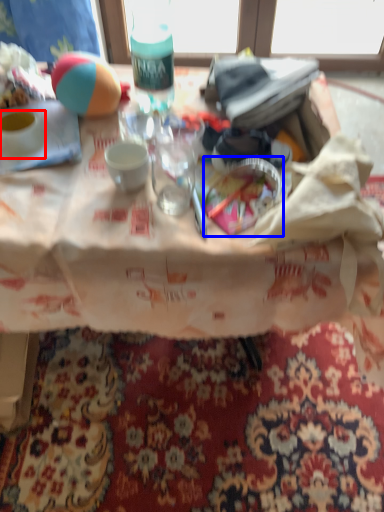
Question: Which point is further to the camera, coffee cup (highlighted by a red box) or tableware (highlighted by a blue box)?

Choices:
 (A) coffee cup
 (B) tableware

Answer: (A)